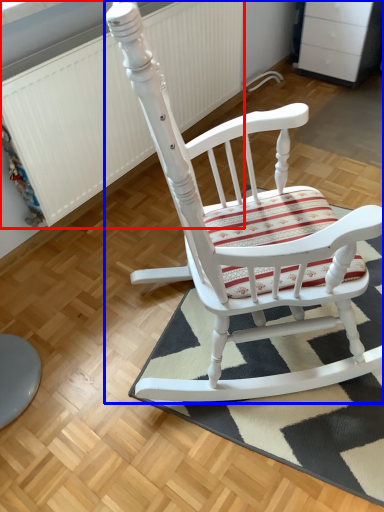
Question: Which object appears farthest to the camera in this image, radiator (highlighted by a red box) or chair (highlighted by a blue box)?

Choices:
 (A) radiator
 (B) chair

Answer: (A)